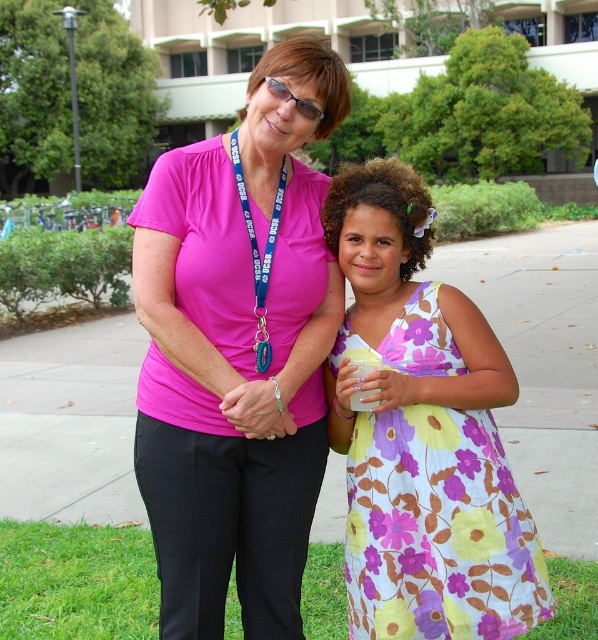
You are a photographer trying to capture a clear shot of the pink fabric shirt at center and the paved concrete sidewalk at center. Which object is closer to the camera?

The pink fabric shirt at center is closer to the camera because it is in front of the paved concrete sidewalk at center.

What is the exact coordinate of the pink fabric shirt at center?

The pink fabric shirt at center is located at point (237, 352).

You are a photographer trying to capture a photo of both the woman and the girl in the scene. You want to ensure that both subjects are in focus. Given that your camera can only focus on objects at a single depth plane, which point should you focus on to maximize the chances of both being in focus? The points are point 1 at coordinates point (x=270, y=371) and point 2 at coordinates point (x=535, y=556).

You should focus on point 1 at coordinates point (x=270, y=371) because it is closer to the viewer than point 2 at coordinates point (x=535, y=556). By focusing on the closer point, the depth of field may extend to include the farther point, increasing the likelihood that both subjects are in focus.